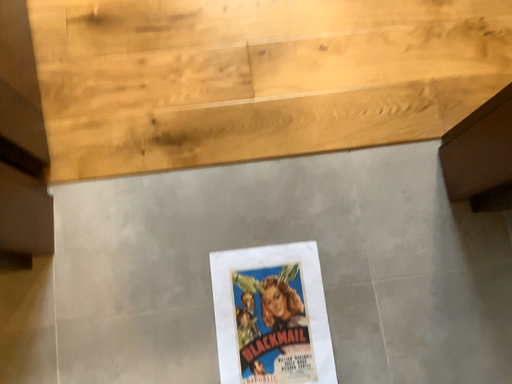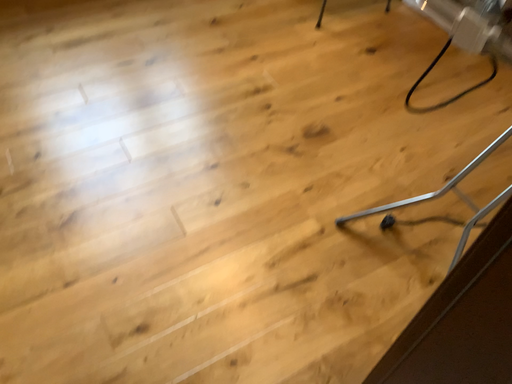
Question: Which way did the camera rotate in the video?

Choices:
 (A) rotated downward
 (B) rotated upward

Answer: (B)